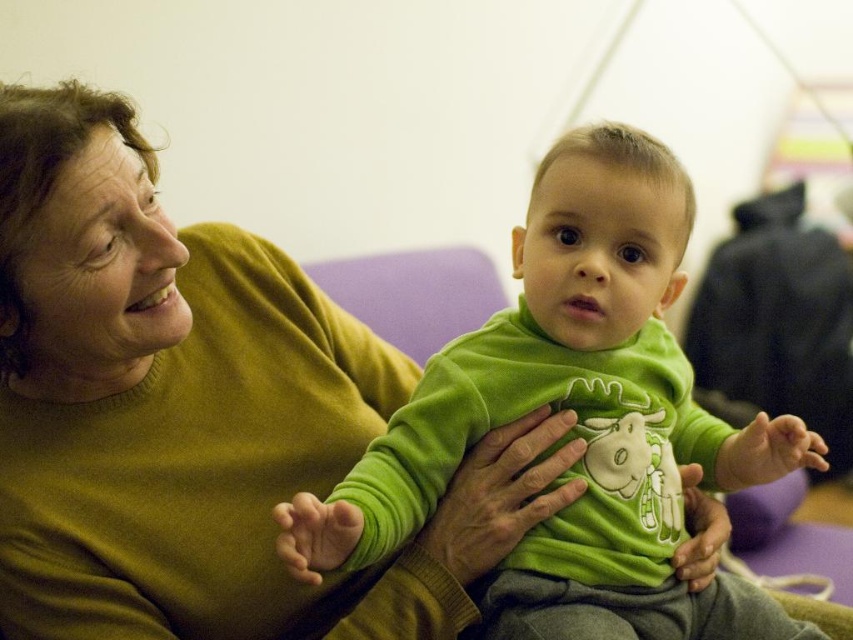
You are a photographer setting up a shoot in this scene. You need to place a small light to the right of the green velvety shirt at center. Where should you position it relative to the matte green sweater at center?

The matte green sweater at center is to the left of the green velvety shirt at center. Therefore, placing the light to the right of the green velvety shirt at center would position it to the right of the matte green sweater at center as well.

You are standing in front of the scene and want to touch the two points mentioned. Which point, point (x=35, y=410) or point (x=534, y=545), will require you to reach further?

Point (x=534, y=545) will require you to reach further because it is farther from the viewer compared to point (x=35, y=410).

You are a photographer trying to capture the baby in the green velvety shirt at center and the woman in the matte green sweater at center. To ensure both are in focus, you need to know their vertical positions. Which one is positioned lower?

The matte green sweater at center is located below the green velvety shirt at center, so the matte green sweater at center is positioned lower.